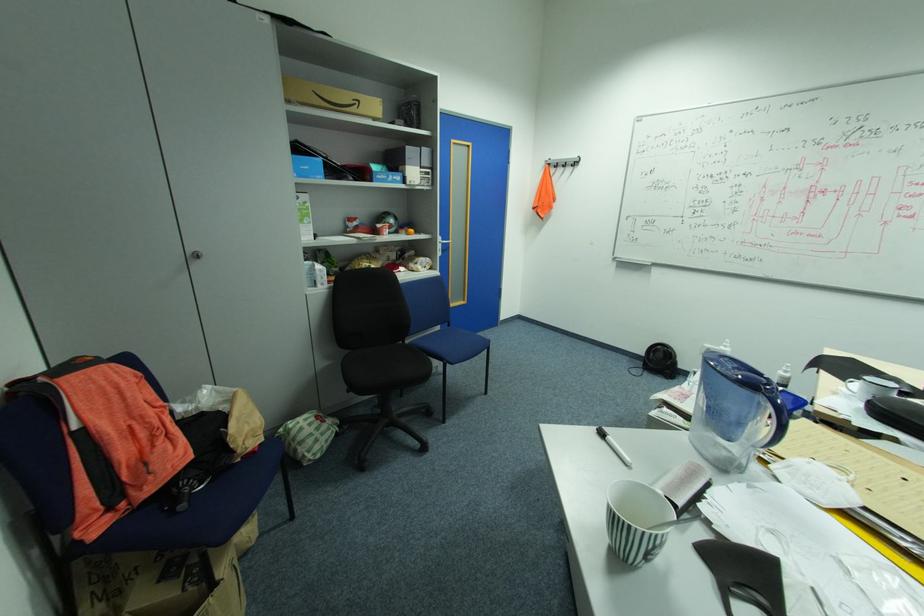
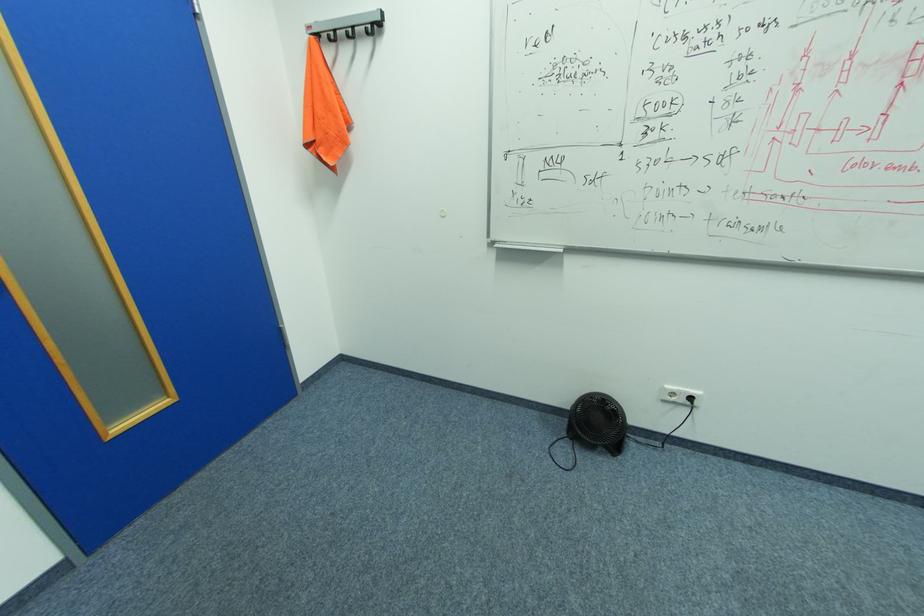
Find the pixel in the second image that matches point (581, 161) in the first image.

(379, 23)